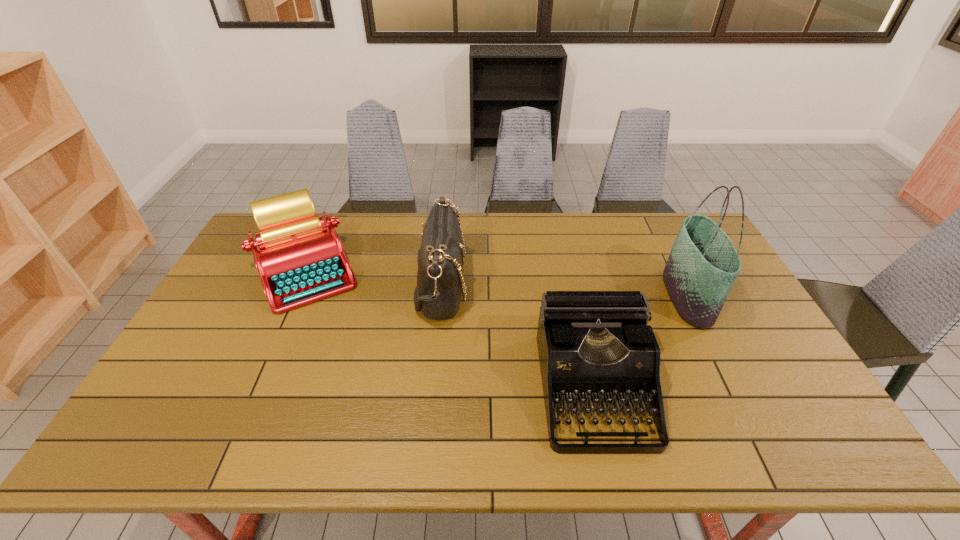
Locate an element on the screen. This screenshot has height=540, width=960. vacant position located on the typing side of the farther typewriter is located at coordinates pos(269,353).

Image resolution: width=960 pixels, height=540 pixels. I want to click on handbag positioned at the far edge, so click(440, 260).

The height and width of the screenshot is (540, 960). In order to click on typewriter at the far edge in this screenshot , I will do `click(300, 261)`.

You are a GUI agent. You are given a task and a screenshot of the screen. Output one action in this format:
    pyautogui.click(x=<x>, y=<y>)
    Task: Click on the object at the near edge
    
    Given the screenshot: What is the action you would take?
    pyautogui.click(x=594, y=346)

Where is `object at the left edge`? The height and width of the screenshot is (540, 960). object at the left edge is located at coordinates (300, 261).

You are a GUI agent. You are given a task and a screenshot of the screen. Output one action in this format:
    pyautogui.click(x=<x>, y=<y>)
    Task: Click on the object situated at the right edge
    The height and width of the screenshot is (540, 960).
    Given the screenshot: What is the action you would take?
    pyautogui.click(x=703, y=264)

Locate an element on the screen. This screenshot has width=960, height=540. object that is at the far left corner is located at coordinates (300, 261).

You are a GUI agent. You are given a task and a screenshot of the screen. Output one action in this format:
    pyautogui.click(x=<x>, y=<y>)
    Task: Click on the vacant region at the far edge of the desktop
    
    Given the screenshot: What is the action you would take?
    pyautogui.click(x=352, y=218)

At what (x,y) coordinates should I click in order to perform the action: click on vacant space at the near edge of the desktop. Please return your answer as a coordinate pair (x, y). Looking at the image, I should click on (338, 435).

Image resolution: width=960 pixels, height=540 pixels. What are the coordinates of `blank space at the left edge of the desktop` in the screenshot? It's located at (154, 400).